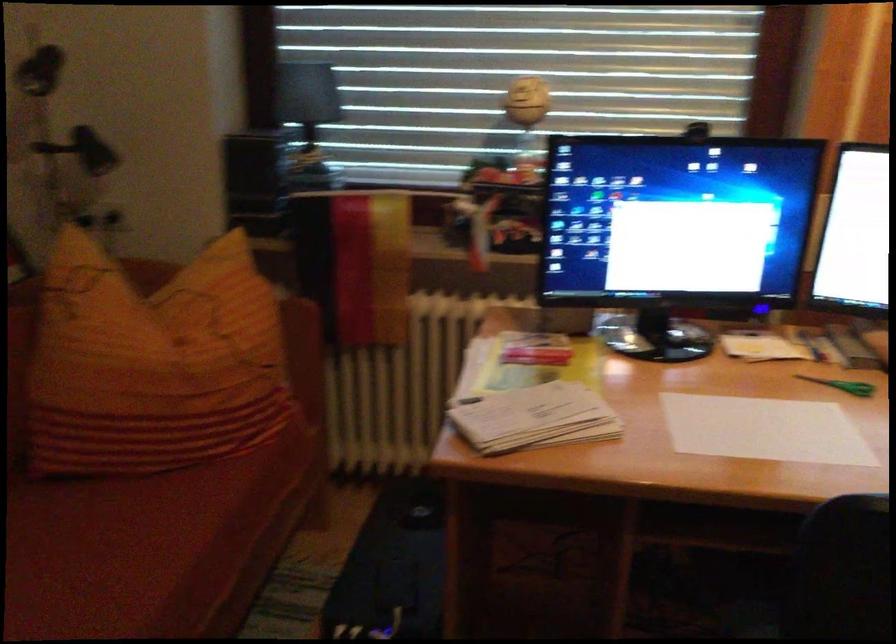
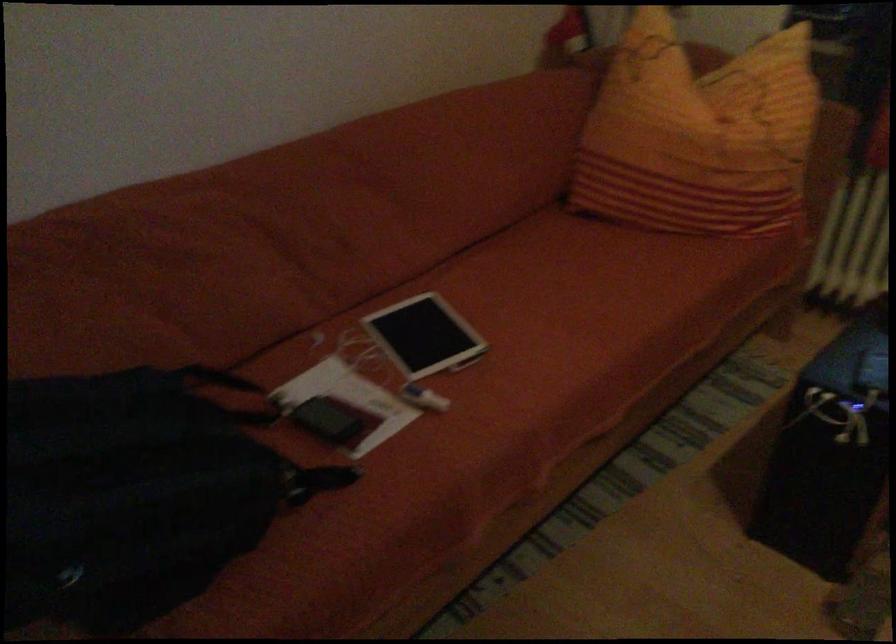
In the second image, find the point that corresponds to point (161, 364) in the first image.

(698, 135)